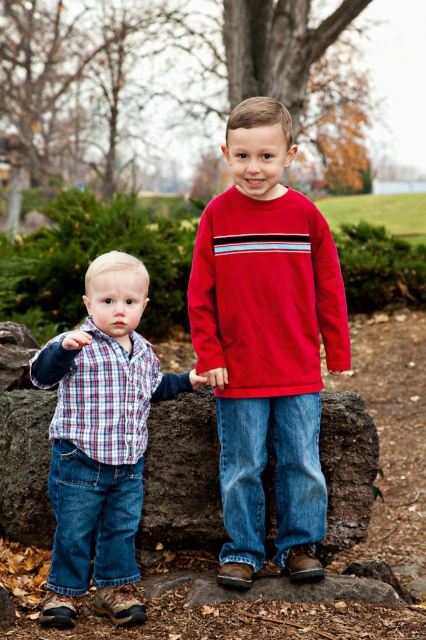
You are a photographer trying to capture a photo of both the plaid shirt at left and the red fleece sweatshirt at center. The camera you have can only focus on objects within a 20 inch range. Can you fit both subjects within the camera focus range?

The plaid shirt at left and red fleece sweatshirt at center are 19.57 inches apart from each other, so yes, both subjects can be captured within the camera focus range since the distance between them is less than 20 inches.